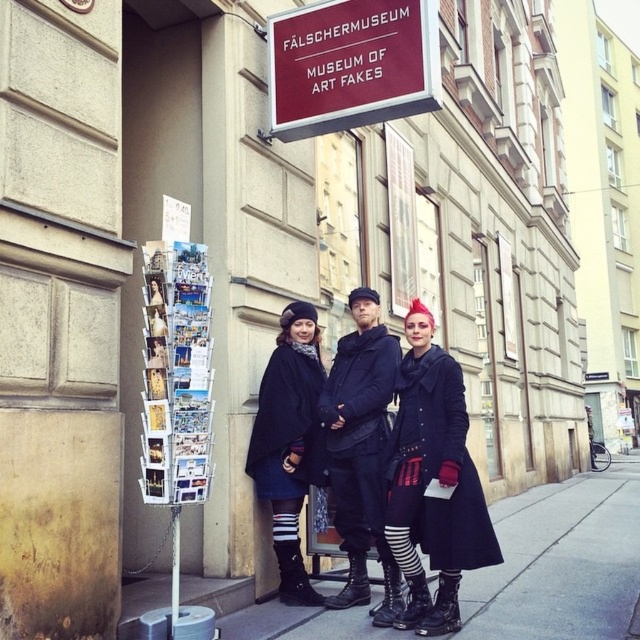
Can you confirm if black leather jacket at center is thinner than matte black coat at center?

Incorrect, black leather jacket at center's width is not less than matte black coat at center's.

Can you confirm if black leather jacket at center is smaller than matte black coat at center?

Actually, black leather jacket at center might be larger than matte black coat at center.

Which is in front, point (333, 449) or point (259, 484)?

Point (333, 449) is in front.

Locate an element on the screen. This screenshot has height=640, width=640. black leather jacket at center is located at coordinates (362, 451).

Who is more distant from viewer, (426, 516) or (604, 577)?

The point (604, 577) is more distant.

Is point (458, 428) positioned before point (259, 628)?

Yes.

You are a GUI agent. You are given a task and a screenshot of the screen. Output one action in this format:
    pyautogui.click(x=<x>, y=<y>)
    Task: Click on the black matte coat at center
    The image size is (640, 640).
    Given the screenshot: What is the action you would take?
    pyautogui.click(x=404, y=465)

Can you confirm if black matte coat at center is positioned to the right of black leather jacket at center?

Yes, black matte coat at center is to the right of black leather jacket at center.

Does black matte coat at center appear under black leather jacket at center?

No.

Is point (353, 307) positioned before point (340, 454)?

No, it is behind (340, 454).

The height and width of the screenshot is (640, 640). What are the coordinates of `black matte coat at center` in the screenshot? It's located at (404, 465).